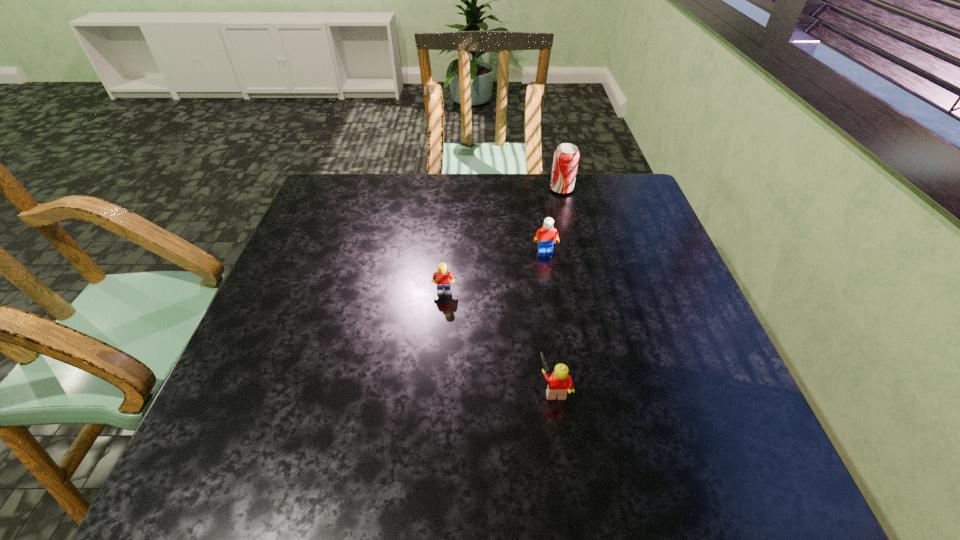
What are the coordinates of `vacant space located in front of the nearest object with the accessory visible` in the screenshot? It's located at (375, 388).

Where is `free space located 0.310m in front of the nearest object with the accessory visible`? Image resolution: width=960 pixels, height=540 pixels. free space located 0.310m in front of the nearest object with the accessory visible is located at coordinates (386, 388).

I want to click on blank space located 0.110m in front of the nearest object with the accessory visible, so click(485, 388).

Image resolution: width=960 pixels, height=540 pixels. What are the coordinates of `vacant position located 0.400m on the front-facing side of the leftmost object` in the screenshot? It's located at (431, 455).

The width and height of the screenshot is (960, 540). In order to click on object situated at the far edge in this screenshot , I will do `click(566, 156)`.

At what (x,y) coordinates should I click in order to perform the action: click on vacant space at the far edge of the desktop. Please return your answer as a coordinate pair (x, y). Looking at the image, I should click on (585, 190).

Image resolution: width=960 pixels, height=540 pixels. Find the location of `free space at the near edge of the desktop`. free space at the near edge of the desktop is located at coordinates (623, 478).

Find the location of a particular element. free region at the left edge of the desktop is located at coordinates (306, 373).

The image size is (960, 540). In the image, there is a desktop. Find the location of `free space at the right edge`. free space at the right edge is located at coordinates (656, 357).

Where is `free space at the near left corner of the desktop`? This screenshot has height=540, width=960. free space at the near left corner of the desktop is located at coordinates (213, 480).